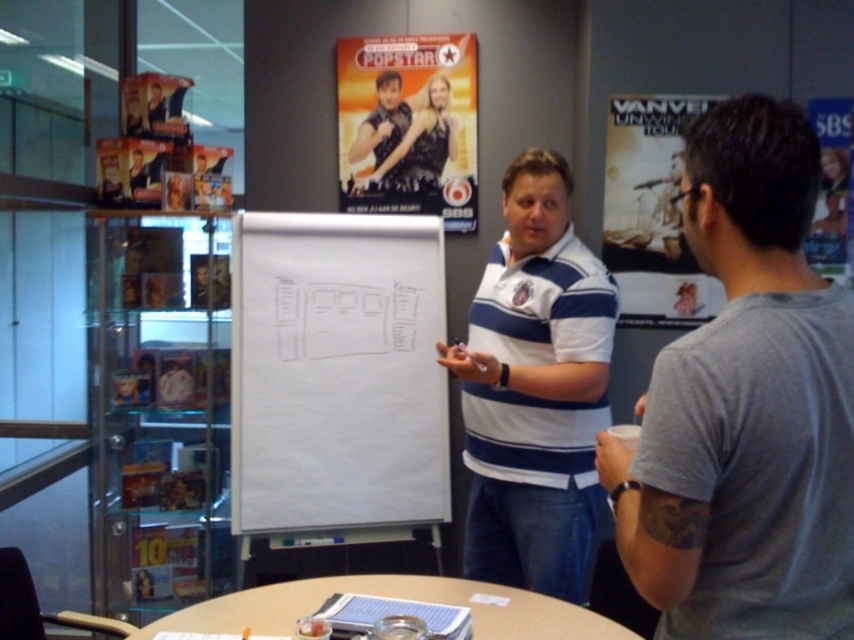
Question: Which point is farther from the camera taking this photo?

Choices:
 (A) (381, 333)
 (B) (843, 145)

Answer: (A)

Question: Can you confirm if whiteboard at center is wider than white paper poster at upper right?

Choices:
 (A) yes
 (B) no

Answer: (A)

Question: Which object is the closest to the metallic silver poster at upper right?

Choices:
 (A) wooden round table at center
 (B) gray cotton t-shirt at right
 (C) whiteboard at center

Answer: (C)

Question: Which point is farther to the camera?

Choices:
 (A) shiny black dress at center
 (B) wooden round table at center

Answer: (A)

Question: Does gray cotton t-shirt at right have a larger size compared to metallic glossy poster at upper center?

Choices:
 (A) no
 (B) yes

Answer: (B)

Question: Can you confirm if whiteboard at center is thinner than white paper poster at upper right?

Choices:
 (A) yes
 (B) no

Answer: (B)